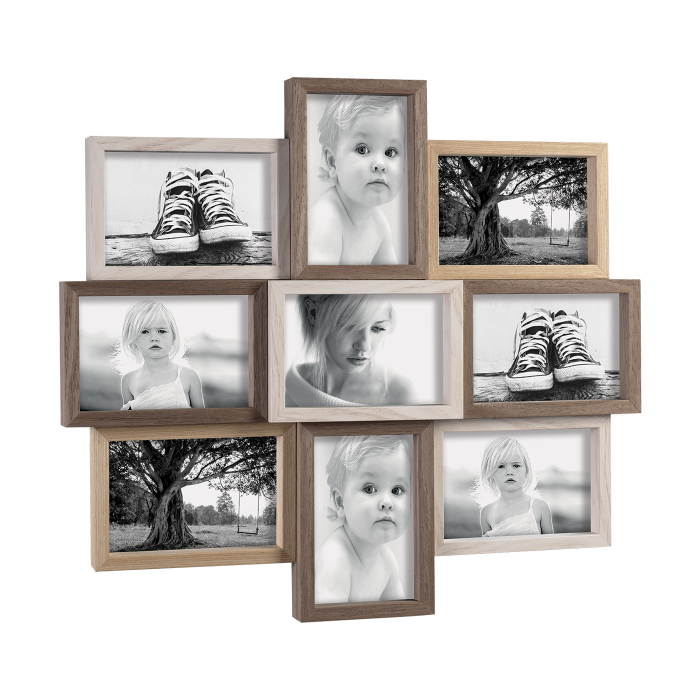
Image resolution: width=700 pixels, height=700 pixels. I want to click on wooden picture frame, so click(x=286, y=456), click(x=420, y=463), click(x=598, y=460), click(x=635, y=360), click(x=455, y=372), click(x=257, y=358), click(x=278, y=182), click(x=421, y=180), click(x=600, y=201).